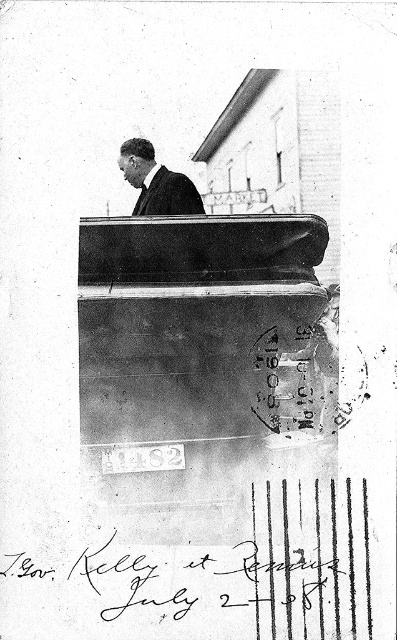
From the picture: In the historical photograph, you notice a dark suit at center and a black silk tie at upper center. Which of these items is taller?

The dark suit at center is taller than the black silk tie at upper center.

In the historical photograph, there is a dark suit at center and a black silk tie at upper center. Which of these two items is larger in size?

The dark suit at center is bigger than the black silk tie at upper center.